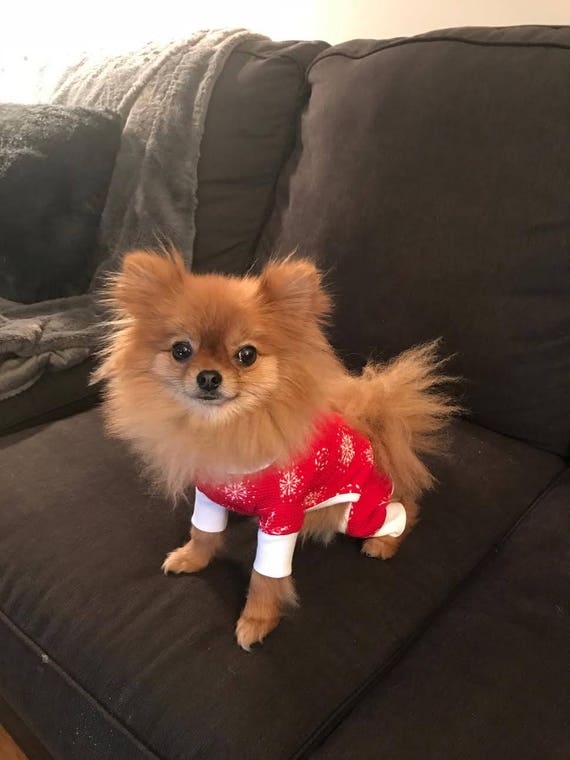
Where is `sofa`? This screenshot has height=760, width=570. sofa is located at coordinates (227, 701).